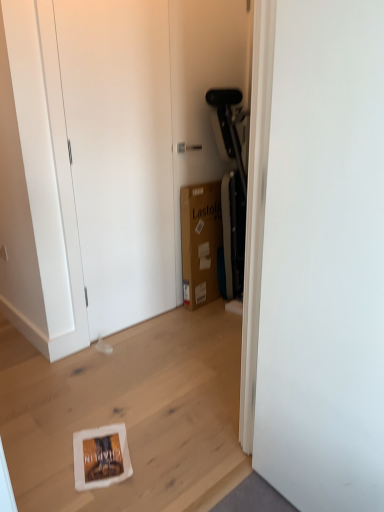
Where is `vacant space to the right of white matte door at upper left, the first door viewed from the left`? The height and width of the screenshot is (512, 384). vacant space to the right of white matte door at upper left, the first door viewed from the left is located at coordinates (192, 326).